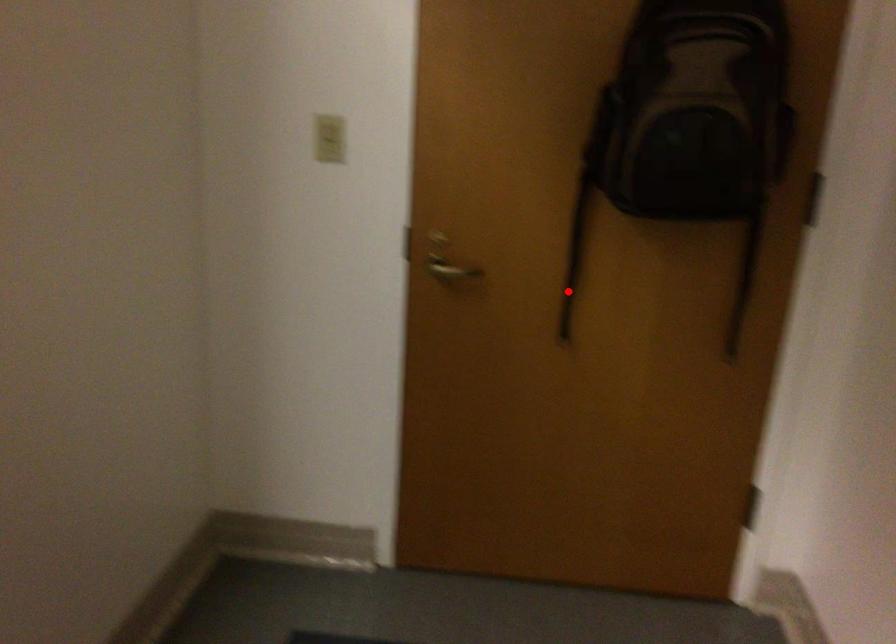
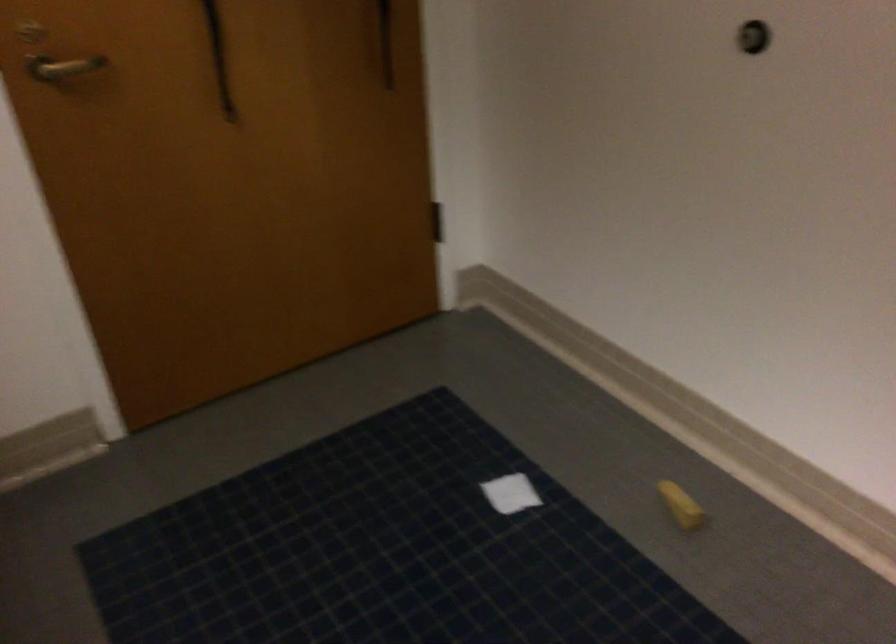
Locate, in the second image, the point that corresponds to the highlighted location in the first image.

(219, 58)